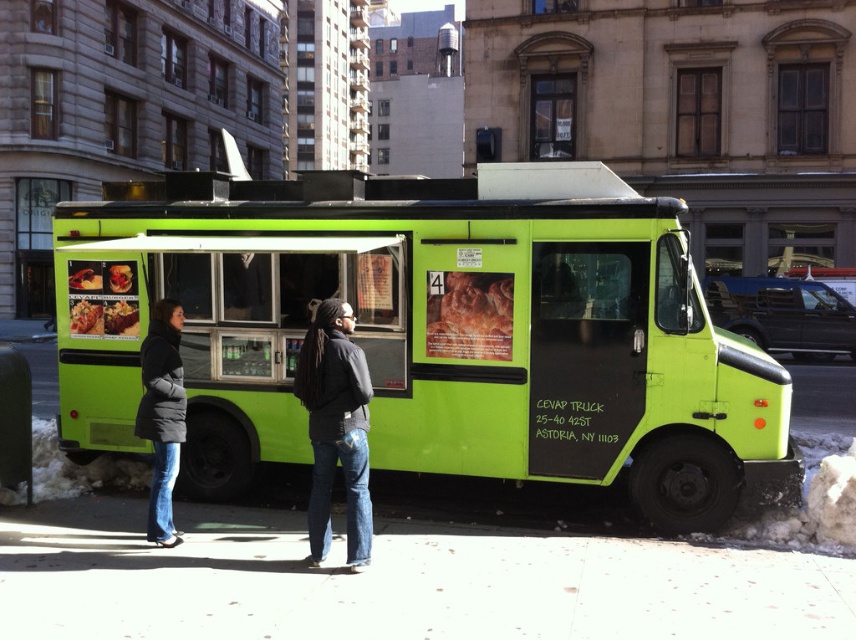
Question: Which of the following is the closest to the observer?

Choices:
 (A) (110, 285)
 (B) (123, 305)
 (C) (97, 324)
 (D) (94, 285)

Answer: (B)

Question: Observing the image, what is the correct spatial positioning of green matte food truck at center in reference to dark gray jacket at center?

Choices:
 (A) above
 (B) below

Answer: (A)

Question: Is dark gray jacket at center bigger than black quilted jacket at left?

Choices:
 (A) no
 (B) yes

Answer: (B)

Question: Which point appears closest to the camera in this image?

Choices:
 (A) (681, 380)
 (B) (75, 275)
 (C) (82, 305)
 (D) (438, 280)

Answer: (A)

Question: Is the position of black quilted jacket at left less distant than that of golden crispy bread at center?

Choices:
 (A) no
 (B) yes

Answer: (B)

Question: Which point is closer to the camera?

Choices:
 (A) matte plastic plate at center
 (B) smooth concrete sidewalk at center

Answer: (B)